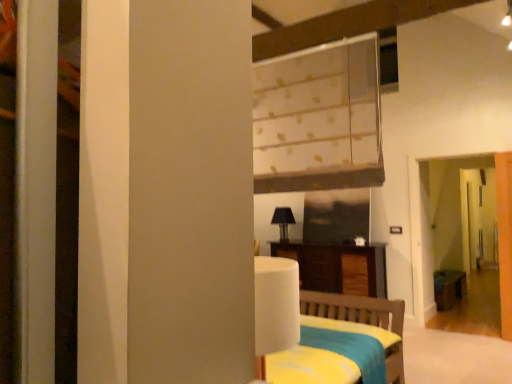
Question: Is white glossy door at right further to camera compared to wooden table at right?

Choices:
 (A) yes
 (B) no

Answer: (A)

Question: Is white glossy door at right positioned in front of wooden table at right?

Choices:
 (A) no
 (B) yes

Answer: (A)

Question: Can you confirm if white glossy door at right is positioned to the left of wooden table at right?

Choices:
 (A) yes
 (B) no

Answer: (B)

Question: Is white glossy door at right with wooden table at right?

Choices:
 (A) yes
 (B) no

Answer: (B)

Question: Is white glossy door at right smaller than wooden table at right?

Choices:
 (A) no
 (B) yes

Answer: (A)

Question: Is white textured blinds at upper center taller or shorter than black matte table lamp at center?

Choices:
 (A) short
 (B) tall

Answer: (B)

Question: In the image, is white textured blinds at upper center positioned in front of or behind black matte table lamp at center?

Choices:
 (A) behind
 (B) front

Answer: (B)

Question: From a real-world perspective, relative to black matte table lamp at center, is white textured blinds at upper center vertically above or below?

Choices:
 (A) above
 (B) below

Answer: (A)

Question: Is white textured blinds at upper center inside or outside of black matte table lamp at center?

Choices:
 (A) outside
 (B) inside

Answer: (A)

Question: In terms of width, does dark wood cabinet at center look wider or thinner when compared to transparent glass screen door at right?

Choices:
 (A) wide
 (B) thin

Answer: (A)

Question: Does point (323, 261) appear closer or farther from the camera than point (436, 251)?

Choices:
 (A) closer
 (B) farther

Answer: (A)

Question: From a real-world perspective, is dark wood cabinet at center physically located above or below transparent glass screen door at right?

Choices:
 (A) above
 (B) below

Answer: (B)

Question: Considering the positions of dark wood cabinet at center and transparent glass screen door at right in the image, is dark wood cabinet at center bigger or smaller than transparent glass screen door at right?

Choices:
 (A) small
 (B) big

Answer: (B)

Question: Is transparent glass screen door at right to the left or to the right of wooden table at right in the image?

Choices:
 (A) right
 (B) left

Answer: (B)

Question: Considering the positions of point (505, 291) and point (441, 307), is point (505, 291) closer or farther from the camera than point (441, 307)?

Choices:
 (A) closer
 (B) farther

Answer: (A)